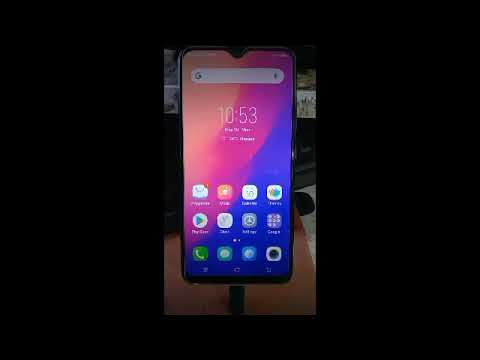
The image size is (480, 360). In order to click on phone in this screenshot , I will do `click(266, 78)`.